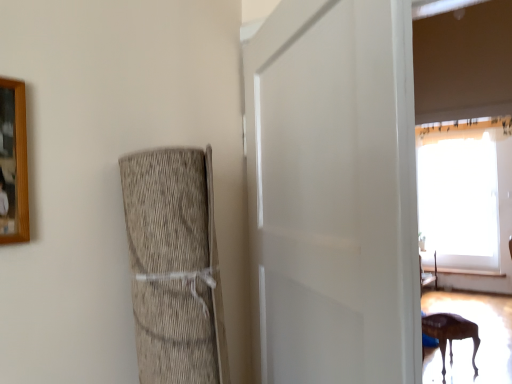
Identify the location of white matte door at center. The image size is (512, 384). (333, 193).

Locate an element on the screen. Image resolution: width=512 pixels, height=384 pixels. wooden picture frame at upper left is located at coordinates (13, 163).

Considering the relative positions of wooden table at lower right and wooden picture frame at upper left in the image provided, is wooden table at lower right in front of wooden picture frame at upper left?

That is False.

Does point (471, 331) come behind point (20, 101)?

Yes, point (471, 331) is behind point (20, 101).

Considering the positions of objects wooden table at lower right and wooden picture frame at upper left in the image provided, who is more to the left, wooden table at lower right or wooden picture frame at upper left?

wooden picture frame at upper left.

Considering the positions of points (24, 152) and (401, 23), is point (24, 152) farther from camera compared to point (401, 23)?

Yes, point (24, 152) is behind point (401, 23).

Identify the location of screen door in front of the wooden picture frame at upper left. (333, 193).

Does wooden picture frame at upper left have a lesser height compared to white matte door at center?

Correct, wooden picture frame at upper left is not as tall as white matte door at center.

Which object is further away from the camera, wooden picture frame at upper left or white matte door at center?

wooden picture frame at upper left.

Are white matte door at center and wooden picture frame at upper left far apart?

That's not correct — white matte door at center is a little close to wooden picture frame at upper left.

Is white matte door at center looking in the opposite direction of wooden picture frame at upper left?

Yes, white matte door at center is positioned with its back facing wooden picture frame at upper left.

How far apart are white matte door at center and wooden picture frame at upper left?

A distance of 65.92 centimeters exists between white matte door at center and wooden picture frame at upper left.

Locate an element on the screen. The height and width of the screenshot is (384, 512). picture frame behind the white matte door at center is located at coordinates (13, 163).

How many degrees apart are the facing directions of white matte door at center and wooden table at lower right?

2.73 degrees separate the facing orientations of white matte door at center and wooden table at lower right.

Would you say white matte door at center is to the left or to the right of wooden table at lower right in the picture?

Based on their positions, white matte door at center is located to the left of wooden table at lower right.

Which point is more forward, (382,123) or (444,375)?

Point (382,123)

Is white matte door at center wider or thinner than wooden table at lower right?

In the image, white matte door at center appears to be more narrow than wooden table at lower right.

Is wooden table at lower right next to white matte door at center?

wooden table at lower right is not next to white matte door at center, and they're not touching.

Based on the photo, which of these two, wooden table at lower right or white matte door at center, is thinner?

white matte door at center.

In the image, is wooden table at lower right positioned in front of or behind white matte door at center?

wooden table at lower right is positioned farther from the viewer than white matte door at center.

Which object is wider, wooden picture frame at upper left or wooden table at lower right?

wooden table at lower right is wider.

From a real-world perspective, is wooden picture frame at upper left located higher than wooden table at lower right?

Yes, from a real-world perspective, wooden picture frame at upper left is over wooden table at lower right

In terms of height, does wooden picture frame at upper left look taller or shorter compared to wooden table at lower right?

wooden picture frame at upper left is shorter than wooden table at lower right.

Considering the points (1, 142) and (451, 353), which point is behind, point (1, 142) or point (451, 353)?

The point (451, 353) is farther.

In the image, there is a wooden table at lower right. Identify the location of picture frame above it (from the image's perspective). The height and width of the screenshot is (384, 512). click(13, 163).

Identify the location of picture frame on the left of white matte door at center. This screenshot has height=384, width=512. pyautogui.click(x=13, y=163).

Consider the image. Which object lies nearer to the anchor point wooden picture frame at upper left, white matte door at center or wooden table at lower right?

Among the two, white matte door at center is located nearer to wooden picture frame at upper left.

From the image, which object appears to be nearer to wooden table at lower right, wooden picture frame at upper left or white matte door at center?

white matte door at center.

Which object lies nearer to the anchor point white matte door at center, wooden table at lower right or wooden picture frame at upper left?

wooden picture frame at upper left lies closer to white matte door at center than the other object.

When comparing their distances from white matte door at center, does wooden picture frame at upper left or wooden table at lower right seem closer?

Among the two, wooden picture frame at upper left is located nearer to white matte door at center.

When comparing their distances from wooden table at lower right, does white matte door at center or wooden picture frame at upper left seem closer?

white matte door at center is positioned closer to the anchor wooden table at lower right.

When comparing their distances from wooden picture frame at upper left, does wooden table at lower right or white matte door at center seem further?

wooden table at lower right is further to wooden picture frame at upper left.

Find the location of a particular element. This screenshot has width=512, height=384. picture frame between white matte door at center and wooden table at lower right along the z-axis is located at coordinates (13, 163).